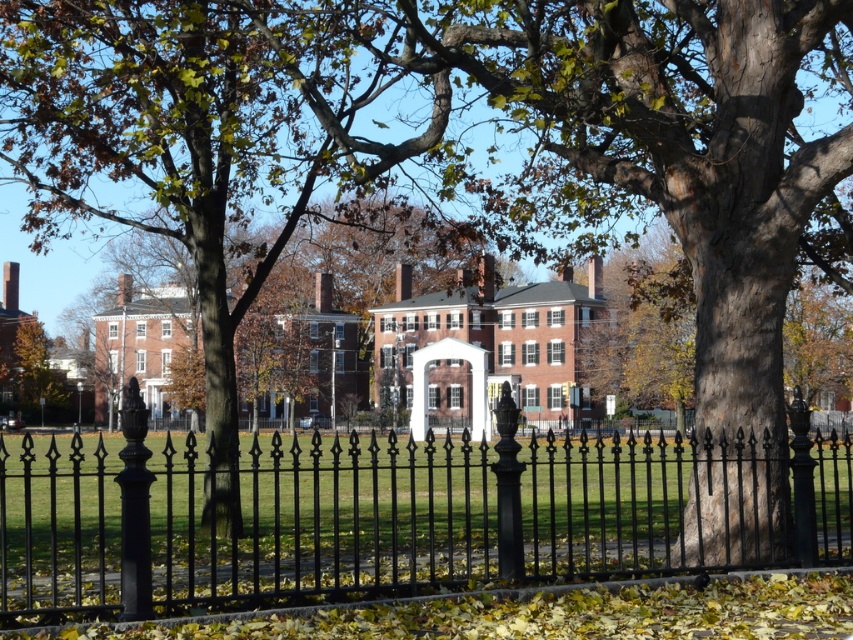
Between black wrought iron fence at center and brown wood tree at center, which one is positioned higher?

brown wood tree at center is higher up.

Who is more forward, (82, 508) or (27, 388)?

Positioned in front is point (82, 508).

Where is `black wrought iron fence at center`? Image resolution: width=853 pixels, height=640 pixels. black wrought iron fence at center is located at coordinates (328, 516).